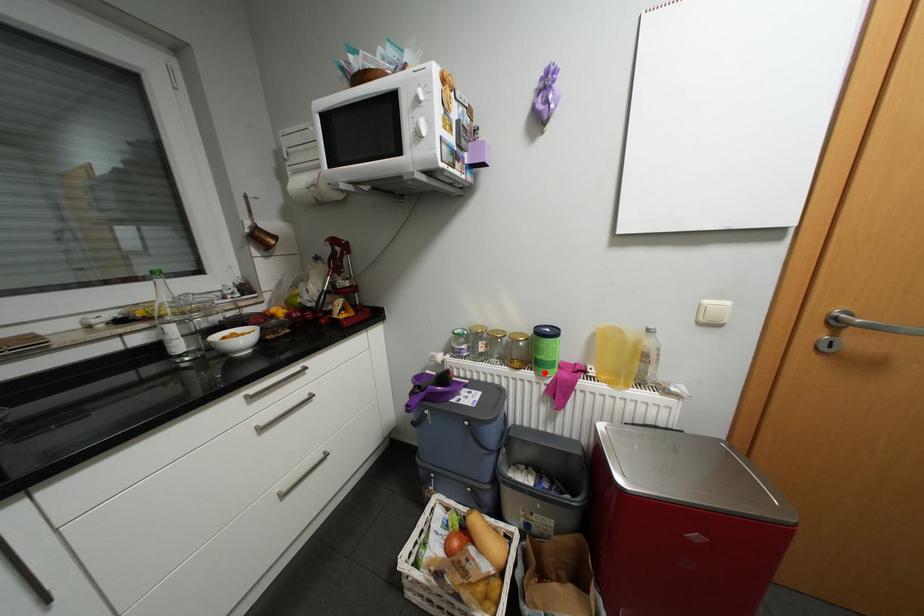
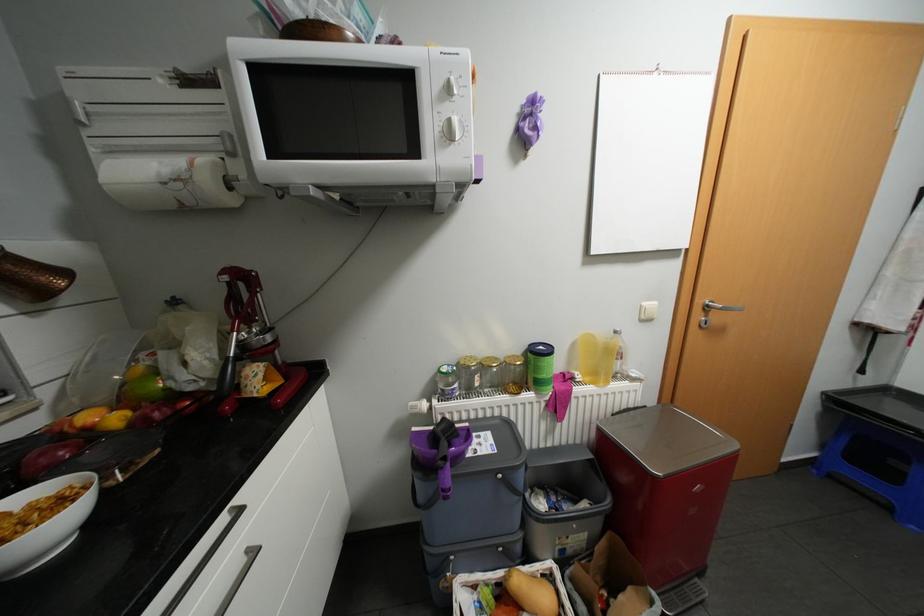
Locate, in the second image, the point that corresponds to the highlighted location in the first image.

(544, 392)